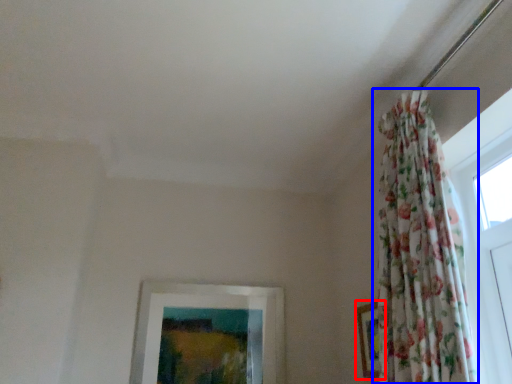
Question: Which point is closer to the camera, picture frame (highlighted by a red box) or curtain (highlighted by a blue box)?

Choices:
 (A) picture frame
 (B) curtain

Answer: (B)